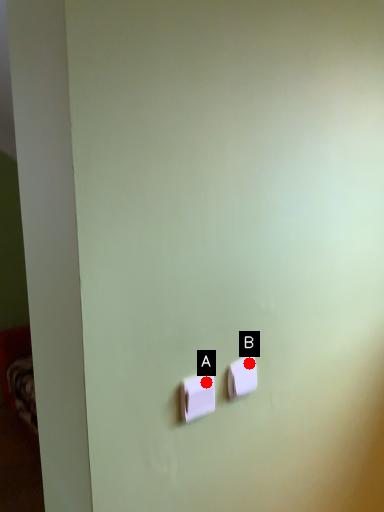
Question: Two points are circled on the image, labeled by A and B beside each circle. Which of the following is the closest to the observer?

Choices:
 (A) A is closer
 (B) B is closer

Answer: (A)